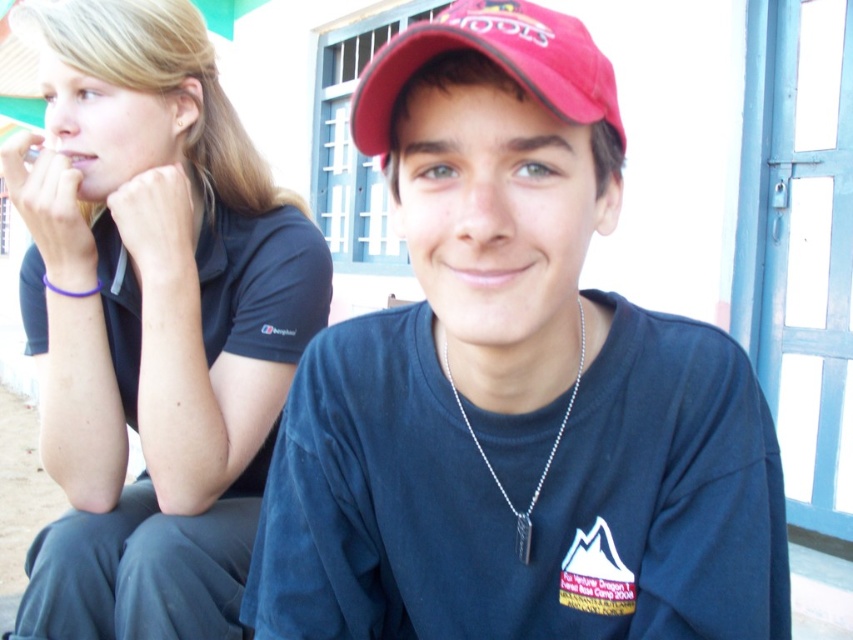
Question: Which object appears closest to the camera in this image?

Choices:
 (A) black matte shirt at upper left
 (B) matte red baseball cap at center
 (C) matte black shirt at center

Answer: (B)

Question: Considering the real-world distances, which object is farthest from the matte red baseball cap at center?

Choices:
 (A) silver chain at center
 (B) matte black shirt at center

Answer: (A)

Question: Where is matte red baseball cap at center located in relation to silver chain at center in the image?

Choices:
 (A) below
 (B) above

Answer: (B)

Question: Does black matte shirt at upper left appear over matte red baseball cap at center?

Choices:
 (A) no
 (B) yes

Answer: (A)

Question: Which point is closer to the camera?

Choices:
 (A) black matte shirt at upper left
 (B) silver chain at center
 (C) matte red baseball cap at center

Answer: (C)

Question: Does black matte shirt at upper left have a lesser width compared to silver chain at center?

Choices:
 (A) no
 (B) yes

Answer: (A)